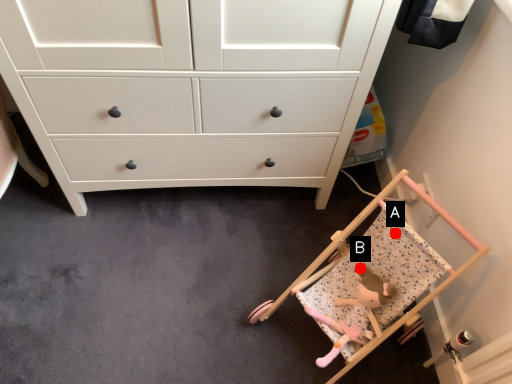
Question: Two points are circled on the image, labeled by A and B beside each circle. Which point appears closest to the camera in this image?

Choices:
 (A) A is closer
 (B) B is closer

Answer: (A)